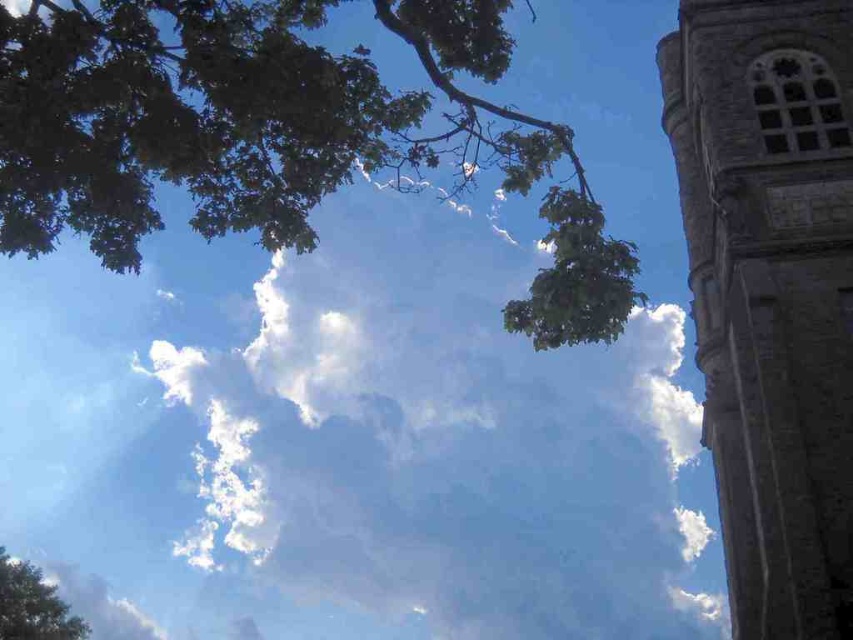
Question: Considering the real-world distances, which object is farthest from the green leafy tree at lower left?

Choices:
 (A) stone tower at right
 (B) green leafy branch at upper left

Answer: (A)

Question: Does green leafy branch at upper left have a greater width compared to green leafy tree at lower left?

Choices:
 (A) no
 (B) yes

Answer: (B)

Question: Which of these objects is positioned closest to the stone tower at right?

Choices:
 (A) green leafy branch at upper left
 (B) green leafy tree at lower left

Answer: (A)

Question: Based on their relative distances, which object is nearer to the stone tower at right?

Choices:
 (A) green leafy tree at lower left
 (B) green leafy branch at upper left

Answer: (B)

Question: In this image, where is green leafy branch at upper left located relative to green leafy tree at lower left?

Choices:
 (A) below
 (B) above

Answer: (B)

Question: Is green leafy branch at upper left to the right of stone tower at right from the viewer's perspective?

Choices:
 (A) no
 (B) yes

Answer: (A)